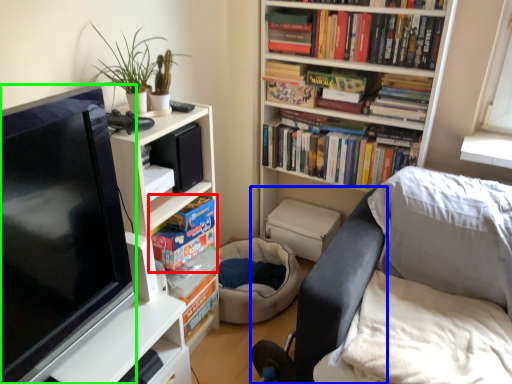
Question: Considering the real-world distances, which object is farthest from book (highlighted by a red box)? swivel chair (highlighted by a blue box) or television (highlighted by a green box)?

Choices:
 (A) swivel chair
 (B) television

Answer: (A)